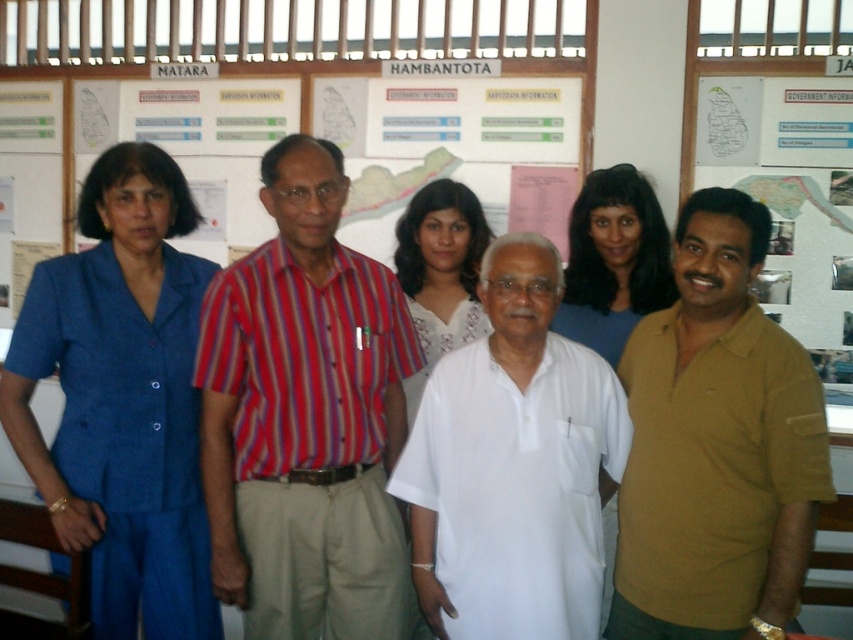
In the scene shown: You are standing in the office scene and want to hand a document to both individuals wearing the matte yellow polo shirt at right and the smooth blue blouse at center. Which person should you approach first to ensure you can reach them without moving past the other?

You should approach the matte yellow polo shirt at right first because it is closer to the viewer than the smooth blue blouse at center, so you can reach them without needing to move past the other person.